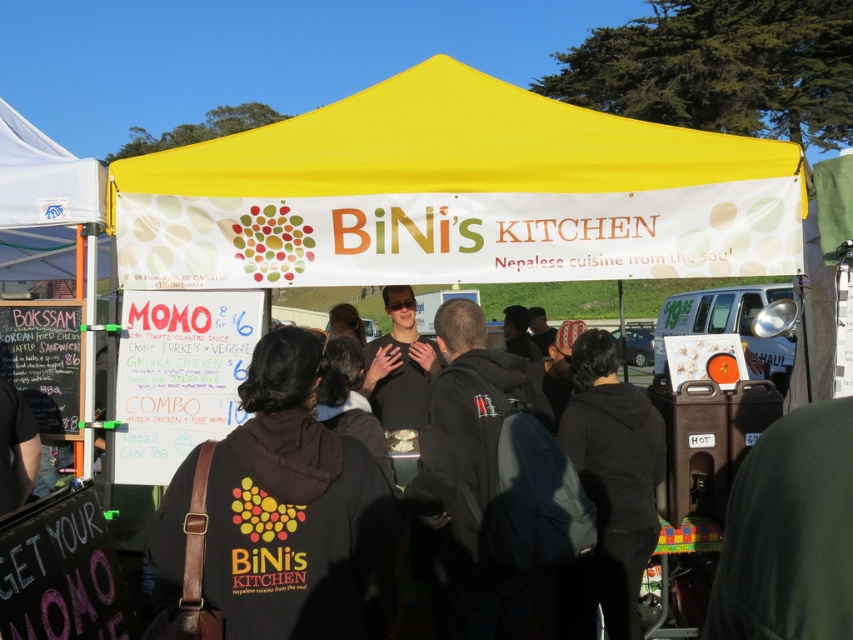
Question: Which of these objects is positioned closest to the dark brown hoodie at center?

Choices:
 (A) black fleece jacket at center
 (B) black fabric crowd at center
 (C) yellow fabric canopy at center

Answer: (B)

Question: Does black fabric crowd at center appear under black fleece jacket at center?

Choices:
 (A) yes
 (B) no

Answer: (B)

Question: Which point is farther to the camera?

Choices:
 (A) black fleece jacket at center
 (B) black fabric crowd at center

Answer: (A)

Question: From the image, what is the correct spatial relationship of black fabric crowd at center in relation to white cardboard sign at right?

Choices:
 (A) above
 (B) below

Answer: (A)

Question: Estimate the real-world distances between objects in this image. Which object is farther from the black fabric crowd at center?

Choices:
 (A) dark brown hoodie at center
 (B) yellow fabric canopy at center
 (C) white cardboard sign at right

Answer: (C)

Question: Is black fabric crowd at center wider than white cardboard sign at right?

Choices:
 (A) no
 (B) yes

Answer: (B)